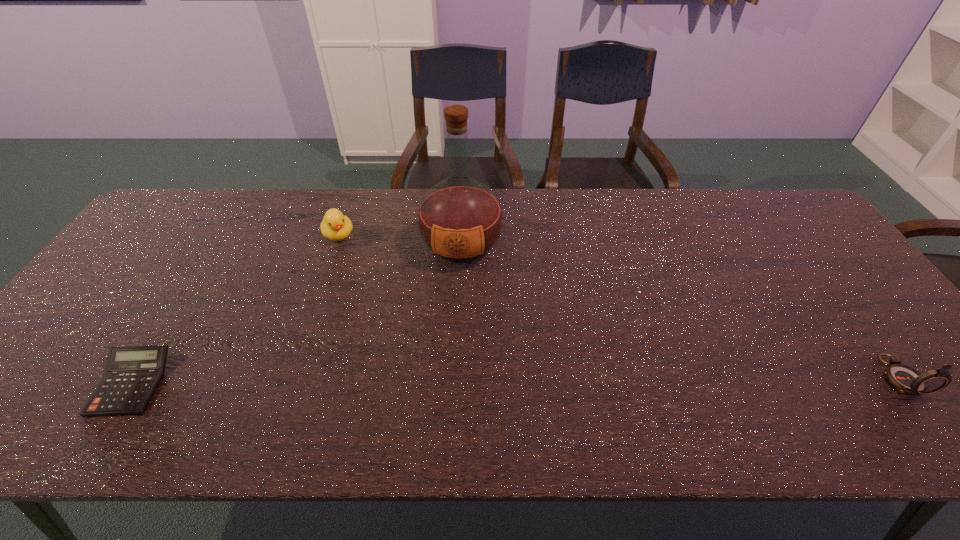
This screenshot has height=540, width=960. I want to click on free spot on the desktop that is between the calculator and the compass and is positioned on the front label of the third object from left to right, so click(447, 381).

This screenshot has width=960, height=540. Find the location of `free space on the desktop that is between the shortest object and the compass and is positioned on the beak of the second object from left to right`. free space on the desktop that is between the shortest object and the compass and is positioned on the beak of the second object from left to right is located at coordinates (406, 381).